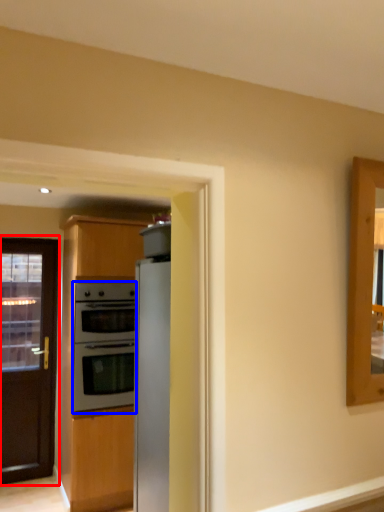
Question: Which object appears closest to the camera in this image, door (highlighted by a red box) or oven (highlighted by a blue box)?

Choices:
 (A) door
 (B) oven

Answer: (B)